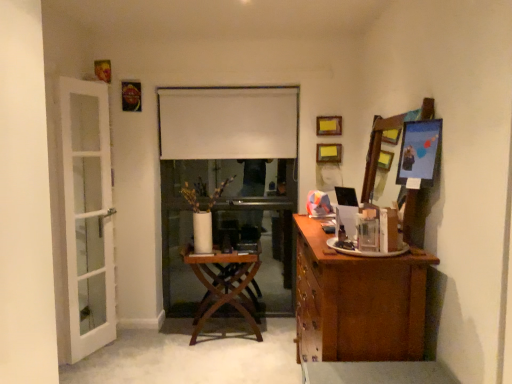
Question: From a real-world perspective, is metallic gold picture frame at upper left, acting as the fifth picture frame starting from the right, above or below white glass door at left?

Choices:
 (A) above
 (B) below

Answer: (A)

Question: From the image's perspective, is metallic gold picture frame at upper left, acting as the fifth picture frame starting from the right, positioned above or below white glass door at left?

Choices:
 (A) above
 (B) below

Answer: (A)

Question: Which object is positioned closest to the wooden picture frame at upper center, the 3th picture frame when ordered from left to right?

Choices:
 (A) metallic silver picture frame at upper right, the 5th picture frame from the top
 (B) wooden picture frame at upper right, which appears as the 5th picture frame when viewed from the front
 (C) white glass door at left
 (D) wooden mirror at right
 (E) white matte curtain at center

Answer: (B)

Question: Which object is the farthest from the white matte curtain at center?

Choices:
 (A) wooden picture frame at upper right, the fourth picture frame when ordered from left to right
 (B) brown wood cabinet at right
 (C) white glass door at left
 (D) wooden picture frame at upper center, positioned as the third picture frame in bottom-to-top order
 (E) wooden mirror at right

Answer: (B)